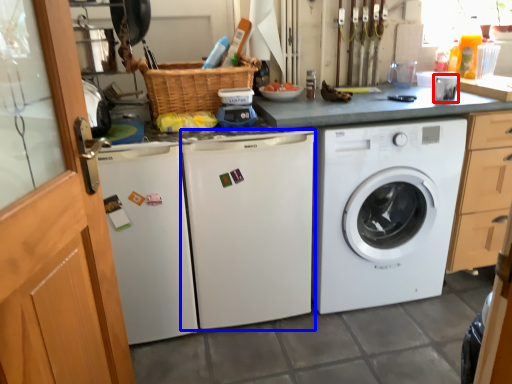
Question: Which of the following is the farthest to the observer, appliance (highlighted by a red box) or washing machine (highlighted by a blue box)?

Choices:
 (A) appliance
 (B) washing machine

Answer: (A)